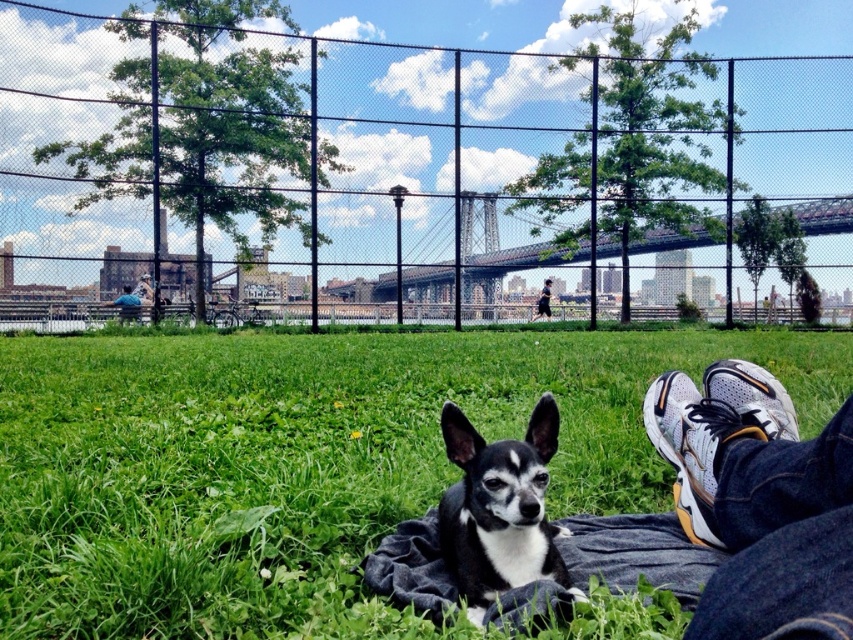
Question: Estimate the real-world distances between objects in this image. Which object is farther from the black fabric pants at lower right?

Choices:
 (A) denim fabric at lower center
 (B) green grass at center
 (C) black and white fur dog at center
 (D) blue denim jacket at upper left

Answer: (C)

Question: Is green grass at center smaller than white mesh sneakers at lower right?

Choices:
 (A) no
 (B) yes

Answer: (A)

Question: Which point appears closest to the camera in this image?

Choices:
 (A) (428, 522)
 (B) (137, 310)
 (C) (334, 570)

Answer: (C)

Question: Is black chain-link fence at center bigger than blue denim jacket at upper left?

Choices:
 (A) yes
 (B) no

Answer: (A)

Question: Can you confirm if green grass at center is positioned to the right of black and white fur dog at center?

Choices:
 (A) yes
 (B) no

Answer: (A)

Question: Which object appears closest to the camera in this image?

Choices:
 (A) white mesh sneakers at lower right
 (B) green grass at center
 (C) black fabric pants at lower right

Answer: (A)